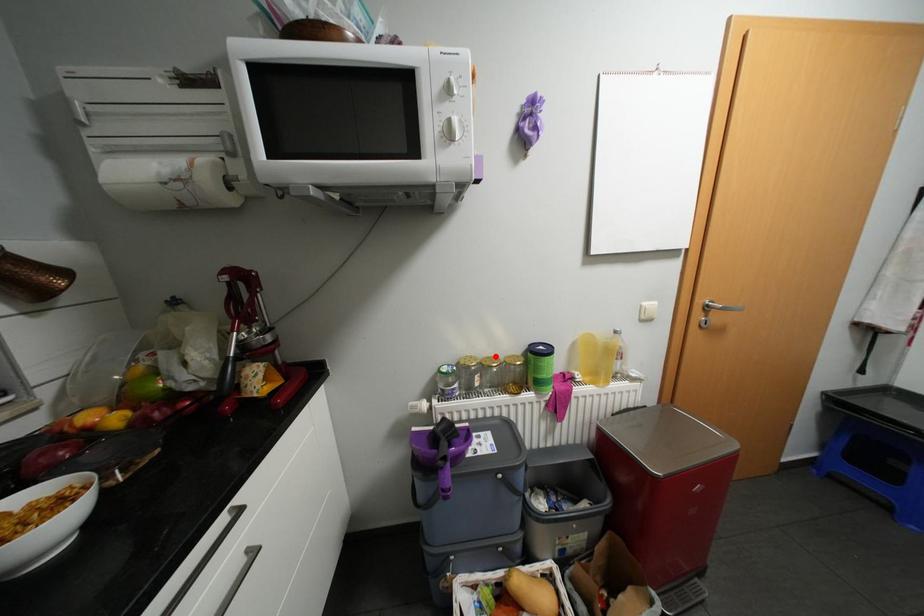
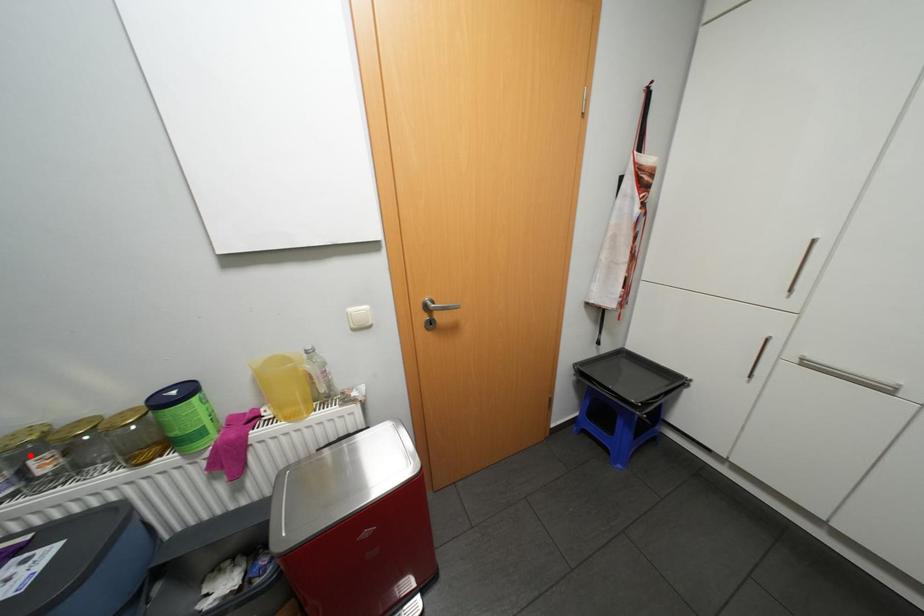
I am providing you with two images of the same scene from different viewpoints. A red point is marked on the first image and another point is marked on the second image. Is the red point in image1 aligned with the point shown in image2?

No